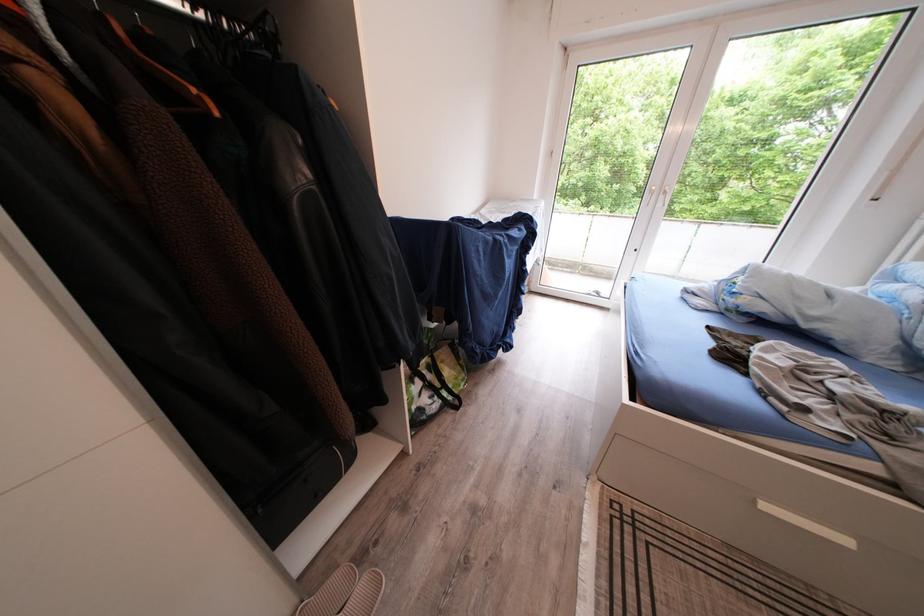
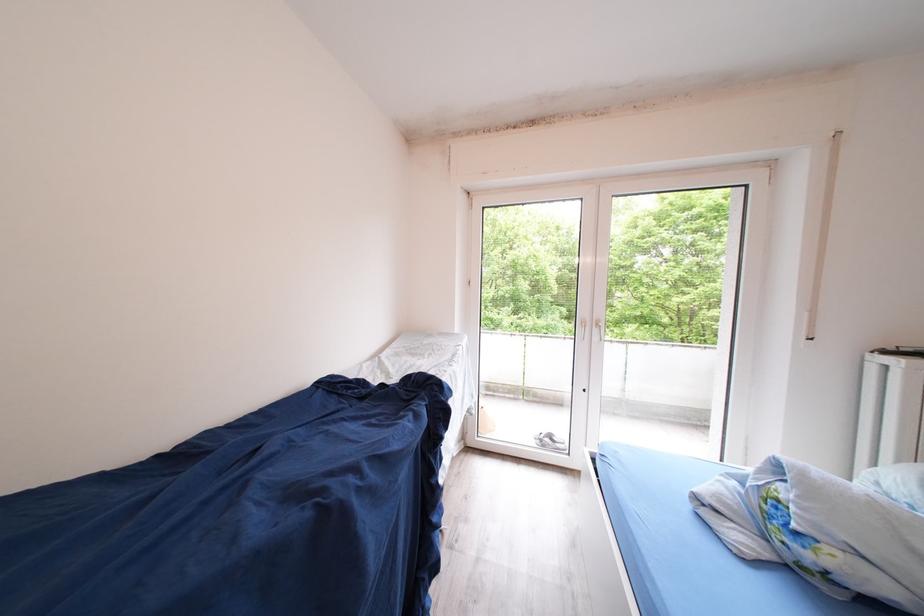
Question: The images are taken continuously from a first-person perspective. In which direction is your viewpoint rotating?

Choices:
 (A) Left
 (B) Right
 (C) Up
 (D) Down

Answer: (C)